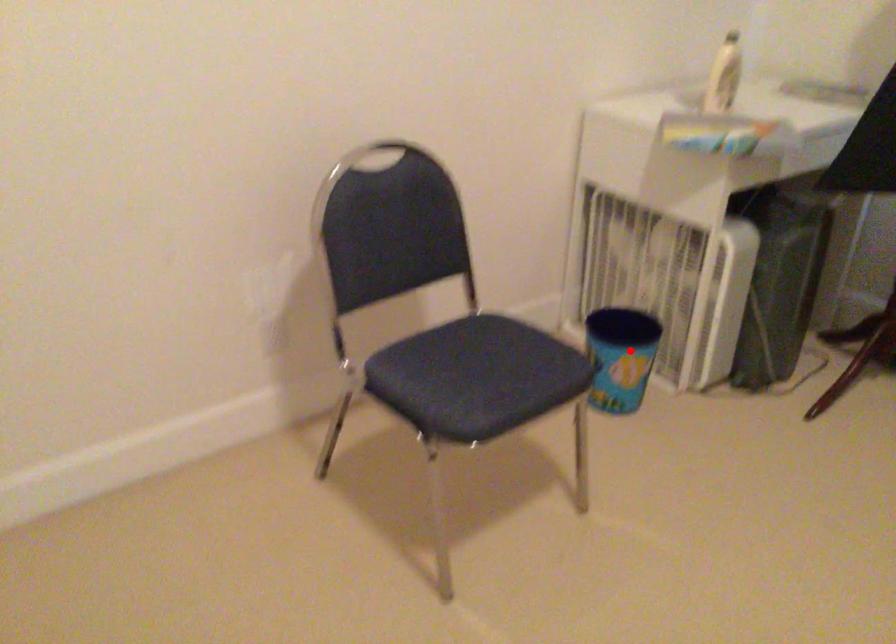
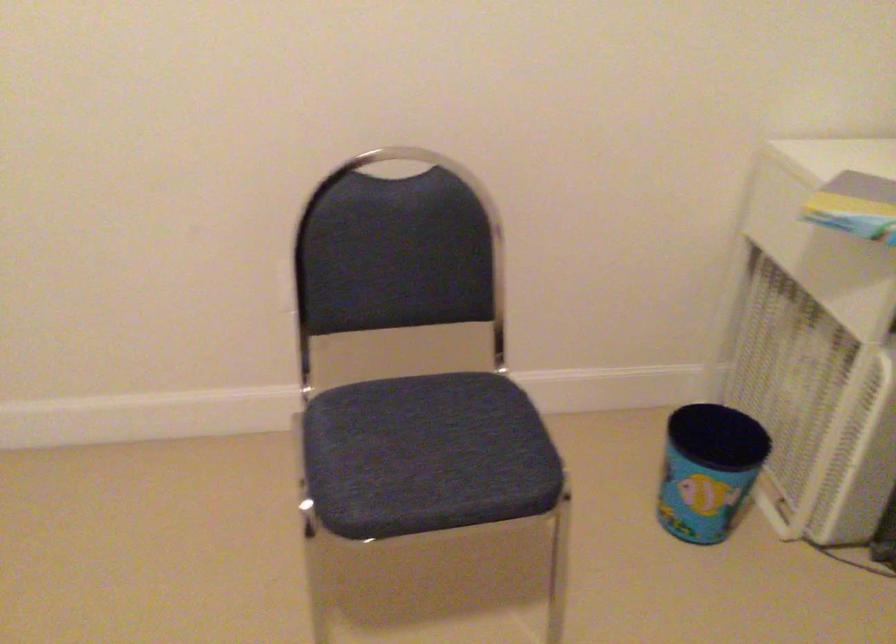
Question: I am providing you with two images of the same scene from different viewpoints. Image1 has a red point marked. In image2, the corresponding 3D location appears at what relative position? Reply with the corresponding letter.

Choices:
 (A) Closer
 (B) Farther

Answer: (A)